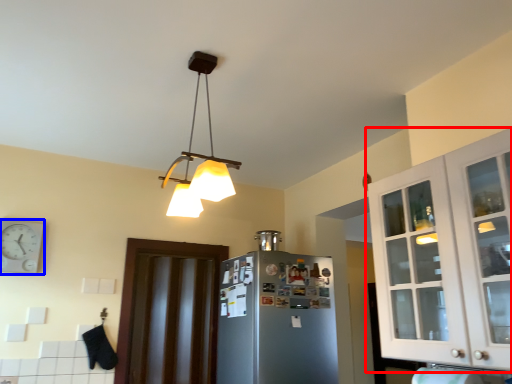
Question: Which object appears closest to the camera in this image, cabinetry (highlighted by a red box) or clock (highlighted by a blue box)?

Choices:
 (A) cabinetry
 (B) clock

Answer: (A)